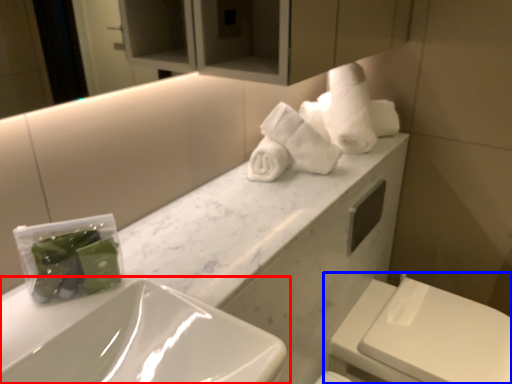
Question: Which object is closer to the camera taking this photo, sink (highlighted by a red box) or toilet (highlighted by a blue box)?

Choices:
 (A) sink
 (B) toilet

Answer: (A)